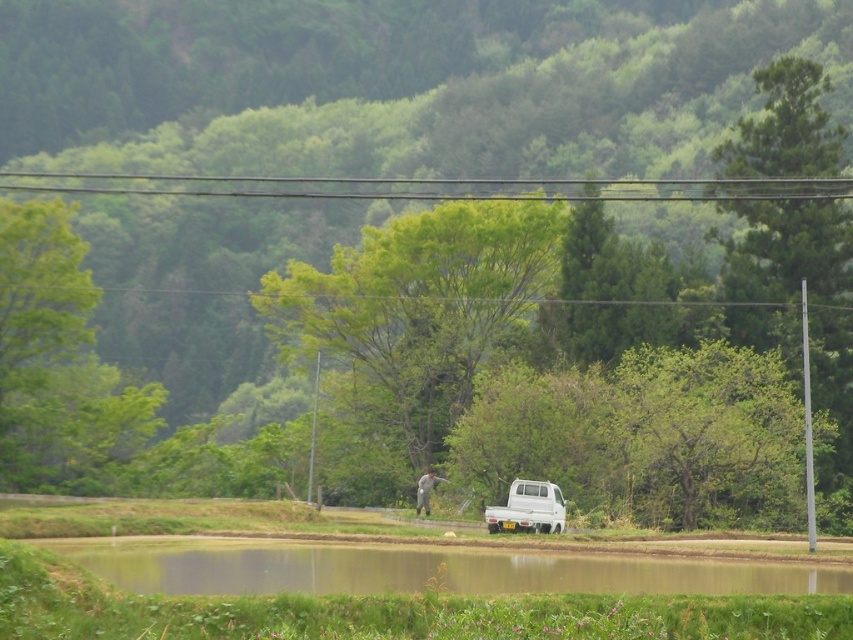
Question: Which of the following is the farthest from the observer?

Choices:
 (A) white matte pickup truck at center
 (B) smooth wire at upper center

Answer: (A)

Question: Is white matte pickup truck at center below green grassy lake at lower center?

Choices:
 (A) no
 (B) yes

Answer: (A)

Question: Which point is closer to the camera?

Choices:
 (A) smooth wire at upper center
 (B) white matte pickup truck at center

Answer: (A)

Question: Does white matte pickup truck at center have a lesser width compared to smooth wire at upper center?

Choices:
 (A) no
 (B) yes

Answer: (B)

Question: Can you confirm if white matte pickup truck at center is smaller than smooth wire at upper center?

Choices:
 (A) yes
 (B) no

Answer: (A)

Question: Which of the following is the closest to the observer?

Choices:
 (A) (498, 193)
 (B) (224, 557)

Answer: (B)